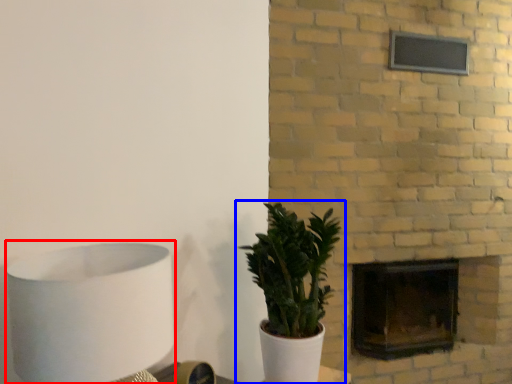
Question: Which object is further to the camera taking this photo, table lamp (highlighted by a red box) or houseplant (highlighted by a blue box)?

Choices:
 (A) table lamp
 (B) houseplant

Answer: (B)